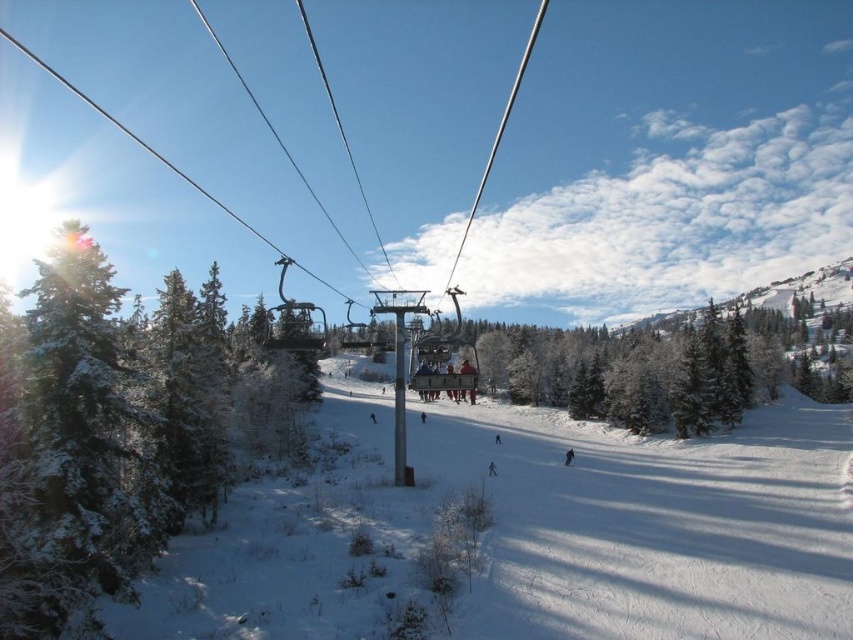
You are a photographer standing at the top of the slope. You want to take a photo of both the black snowboarder at lower center and the white snowboarder at center in the same frame. Which snowboarder should you adjust your camera to focus on first to ensure both are in the shot?

You should focus on the white snowboarder at center first because the black snowboarder at lower center is to the right of it, so adjusting the camera to include both would require framing from the left side where the white snowboarder is positioned.